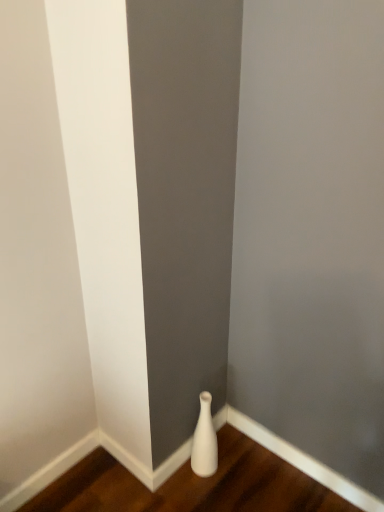
Where is `vacant area that lies to the right of white matte vase at lower right`? vacant area that lies to the right of white matte vase at lower right is located at coordinates (245, 466).